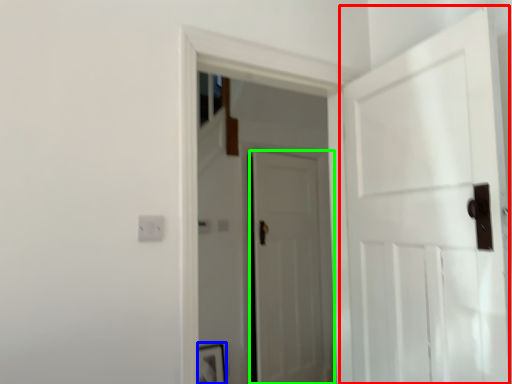
Question: Which object is positioned closest to door (highlighted by a red box)? Select from picture frame (highlighted by a blue box) and door (highlighted by a green box).

Choices:
 (A) picture frame
 (B) door

Answer: (B)